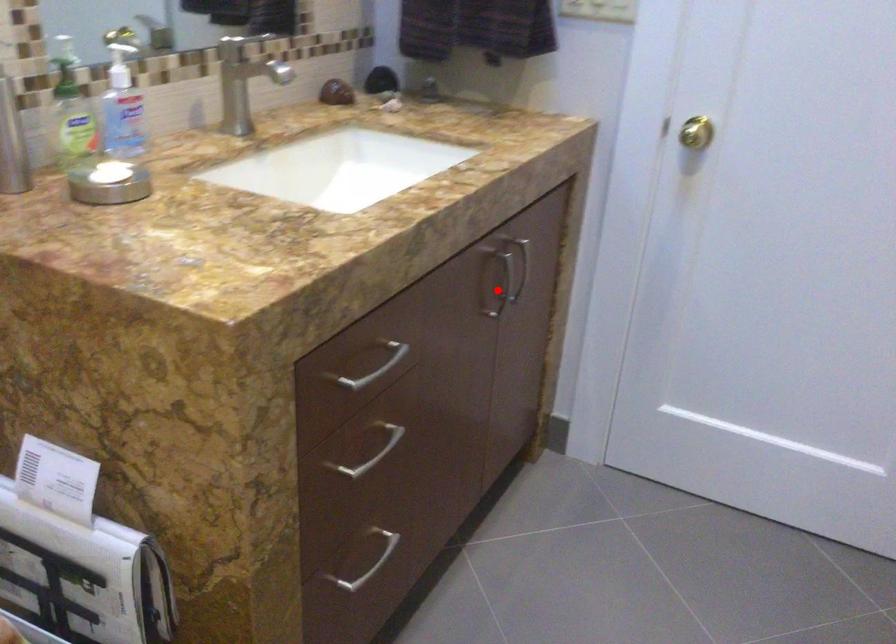
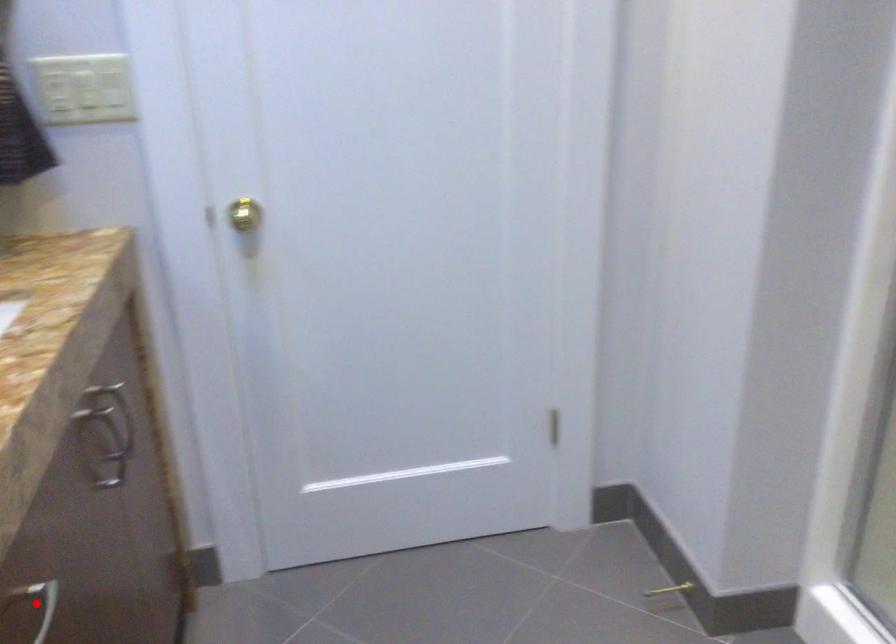
I am providing you with two images of the same scene from different viewpoints. A red point is marked on the first image and another point is marked on the second image. Is the marked point in image1 the same physical position as the marked point in image2?

No